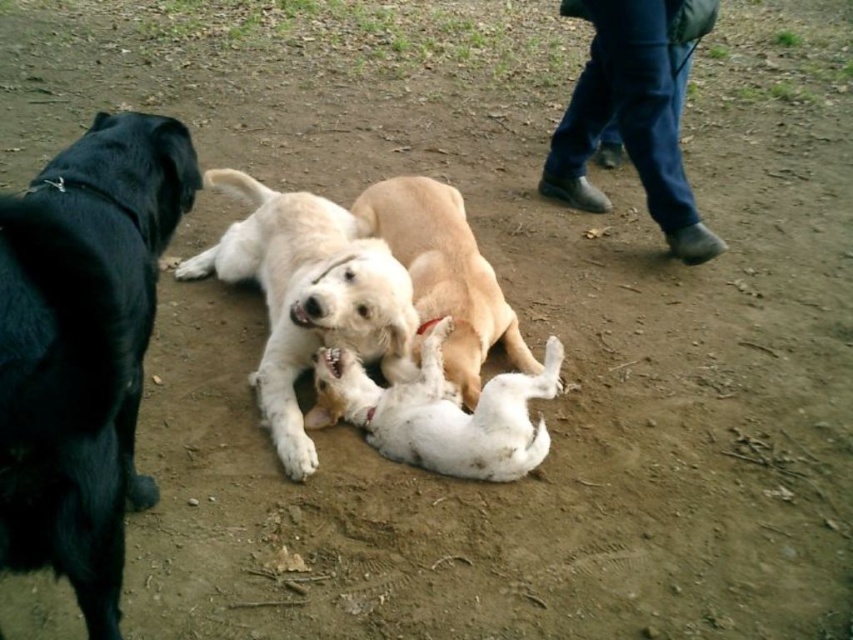
You are a photographer trying to capture a photo of the white fur dog at center and the white soft fur dog at center. Which dog should you focus on first if you want to take a picture from the ground level upwards?

The white fur dog at center is located above the white soft fur dog at center, so you should focus on the white fur dog at center first when taking a photo from the ground level upwards.

In the scene where three dogs are playing, there is a black dog on the left, a golden dog lying on its back in the center, and two white dogs also at the center. The two white dogs are labeled as the white fur dog at center and the white soft fur dog at center. According to the description, which of the two white dogs is located to the left?

The white fur dog at center is positioned on the left side of the white soft fur dog at center.

You are a dog trainer who wants to separate the white fur dog at center and the light brown fur at center. Can you use a 10 inch long leash to tie both dogs together?

The distance between white fur dog at center and light brown fur at center is 11.26 inches. Since the leash is only 10 inches long, it would not be sufficient to connect both dogs together.